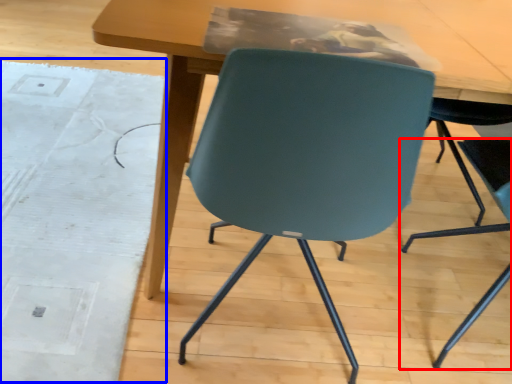
Question: Which point is closer to the camera, chair (highlighted by a red box) or mat (highlighted by a blue box)?

Choices:
 (A) chair
 (B) mat

Answer: (A)